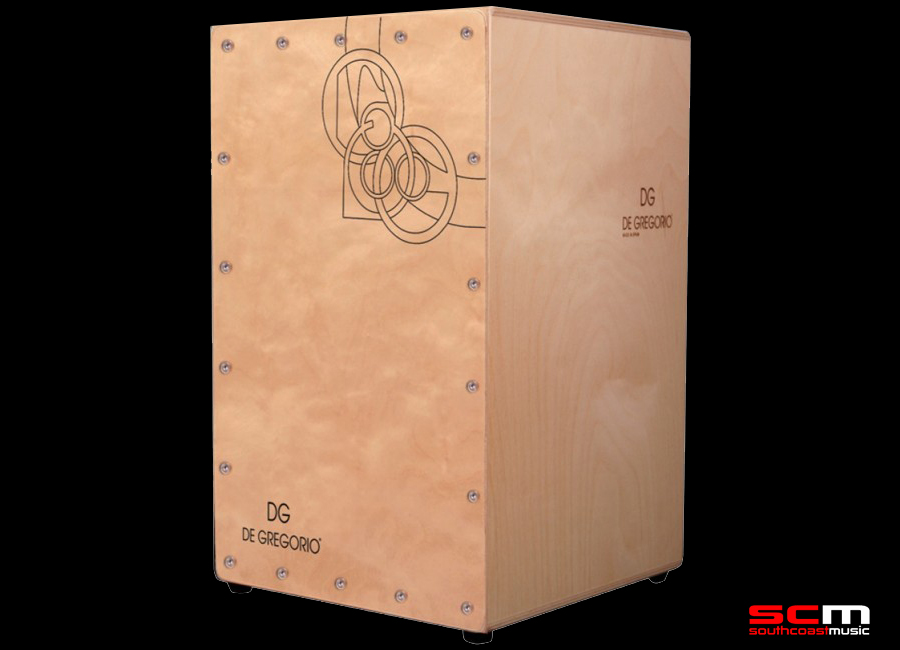
You are a GUI agent. You are given a task and a screenshot of the screen. Output one action in this format:
    pyautogui.click(x=<x>, y=<y>)
    Task: Click on the cajon
    
    Given the screenshot: What is the action you would take?
    pyautogui.click(x=352, y=312)